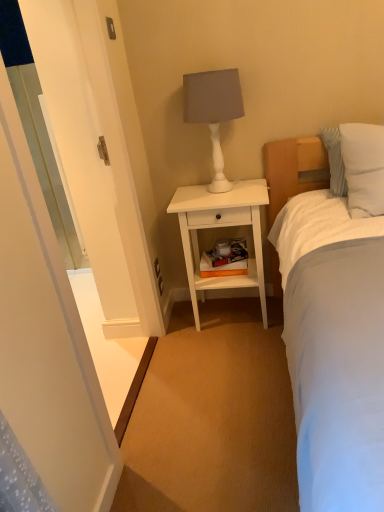
Question: Is white matte nightstand at center closer to camera compared to white glossy screen door at left?

Choices:
 (A) no
 (B) yes

Answer: (A)

Question: Is white glossy screen door at left inside white matte nightstand at center?

Choices:
 (A) no
 (B) yes

Answer: (A)

Question: From the image's perspective, is white matte nightstand at center beneath white glossy screen door at left?

Choices:
 (A) yes
 (B) no

Answer: (A)

Question: Is white matte nightstand at center turned away from white glossy screen door at left?

Choices:
 (A) no
 (B) yes

Answer: (A)

Question: Does white matte nightstand at center have a lesser height compared to white glossy screen door at left?

Choices:
 (A) yes
 (B) no

Answer: (A)

Question: In the image, is white soft pillow at upper right positioned in front of or behind white matte table lamp at upper center?

Choices:
 (A) front
 (B) behind

Answer: (A)

Question: Is white soft pillow at upper right spatially inside white matte table lamp at upper center, or outside of it?

Choices:
 (A) inside
 (B) outside

Answer: (B)

Question: In terms of width, does white soft pillow at upper right look wider or thinner when compared to white matte table lamp at upper center?

Choices:
 (A) wide
 (B) thin

Answer: (A)

Question: In terms of size, does white soft pillow at upper right appear bigger or smaller than white matte table lamp at upper center?

Choices:
 (A) small
 (B) big

Answer: (A)

Question: Does point (355, 177) appear closer or farther from the camera than point (210, 279)?

Choices:
 (A) closer
 (B) farther

Answer: (A)

Question: From a real-world perspective, relative to white matte nightstand at center, is white soft pillow at upper right vertically above or below?

Choices:
 (A) below
 (B) above

Answer: (B)

Question: In terms of height, does white soft pillow at upper right look taller or shorter compared to white matte nightstand at center?

Choices:
 (A) tall
 (B) short

Answer: (B)

Question: Considering the positions of white soft pillow at upper right and white matte nightstand at center in the image, is white soft pillow at upper right wider or thinner than white matte nightstand at center?

Choices:
 (A) wide
 (B) thin

Answer: (B)

Question: Is white matte table lamp at upper center bigger or smaller than white matte nightstand at center?

Choices:
 (A) big
 (B) small

Answer: (B)

Question: Does point (190, 76) appear closer or farther from the camera than point (203, 205)?

Choices:
 (A) farther
 (B) closer

Answer: (B)